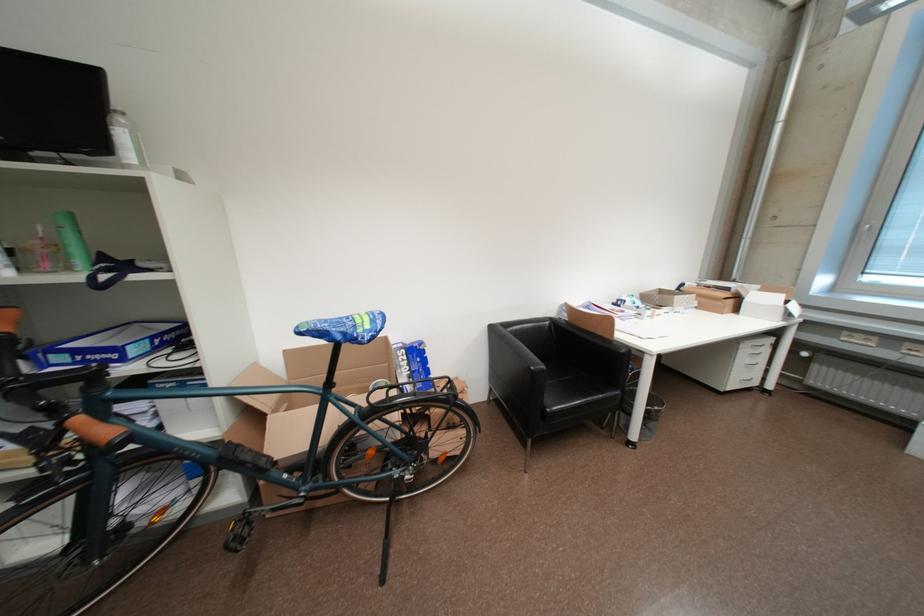
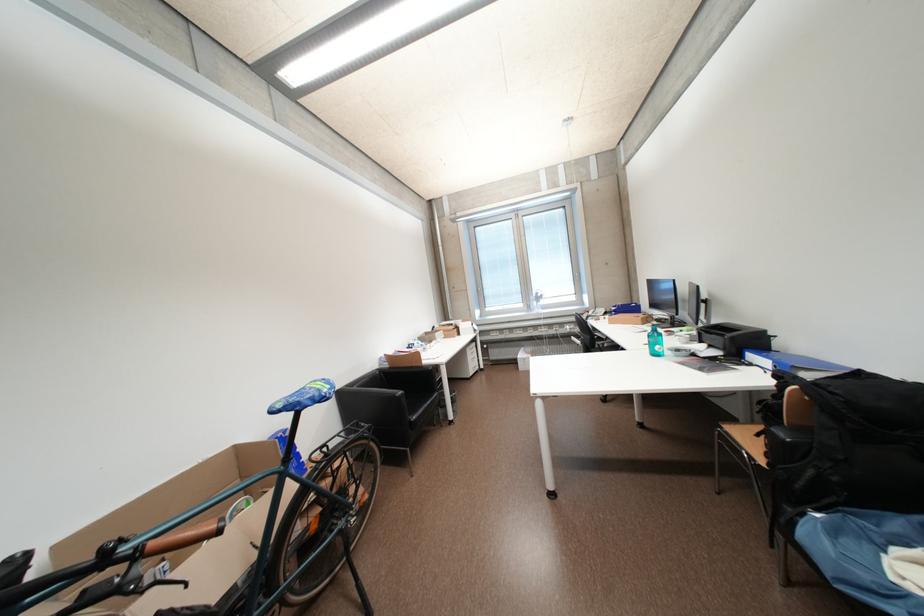
Find the pixel in the second image that matches the point at 689,286 in the first image.

(442, 330)